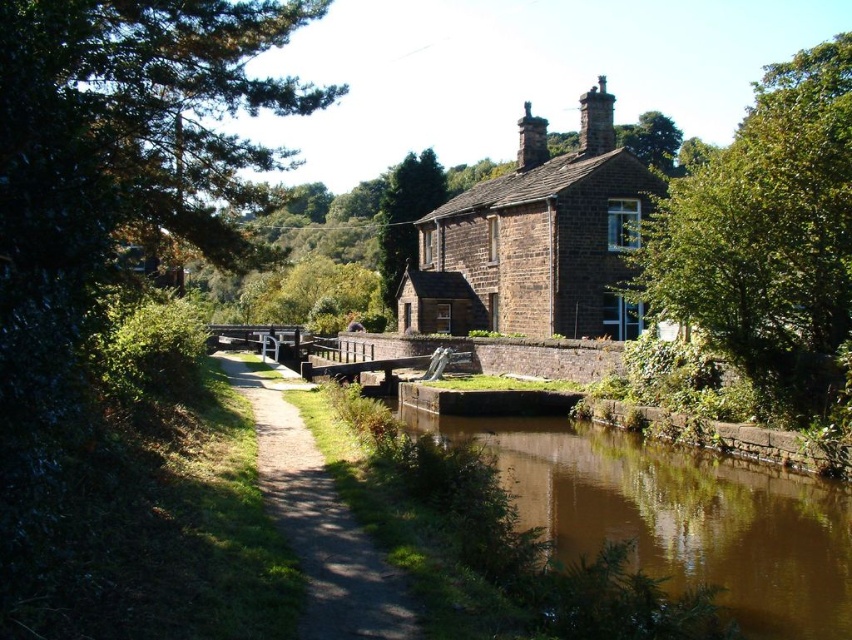
In the scene shown: You are a delivery person trying to navigate through the scene. You need to cross from the brown gravel path at center to the brown stone canal at lower center. Is the canal higher or lower than the path?

The brown stone canal at lower center has a greater height compared to the brown gravel path at center, so the canal is higher than the path.

You are a tourist standing in front of the traditional stone house. You want to take a photo of the green leafy tree at left and the brown gravel path at center. Which object should you focus on first to ensure both are in the frame?

The green leafy tree at left is in front of the brown gravel path at center, so you should focus on the green leafy tree at left first to ensure both are in the frame.

You are standing at the entrance of the stone house and want to take a photo of the green leafy tree at left. Which direction should you face to ensure the tree is in the frame?

The green leafy tree at left is located at point (108, 216), so you should face towards the left side of the scene to capture it in your photo.